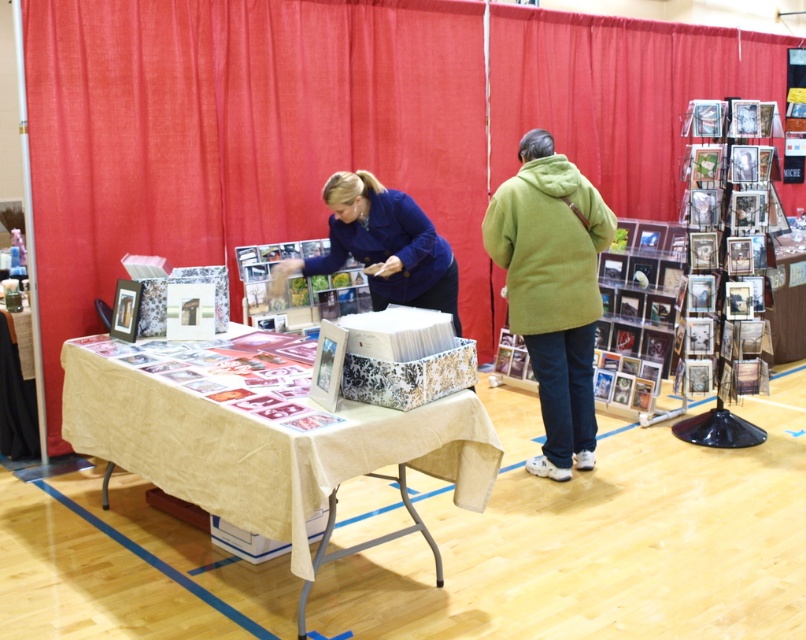
Which is above, green fuzzy jacket at center or blue fabric at center?

Positioned higher is blue fabric at center.

Who is positioned more to the right, green fuzzy jacket at center or blue fabric at center?

green fuzzy jacket at center

Who is more forward, [545,349] or [276,278]?

Point [545,349] is in front.

Locate an element on the screen. green fuzzy jacket at center is located at coordinates (551, 291).

Is beige fabric-covered table at center smaller than green fuzzy jacket at center?

Actually, beige fabric-covered table at center might be larger than green fuzzy jacket at center.

How far apart are beige fabric-covered table at center and green fuzzy jacket at center?

beige fabric-covered table at center and green fuzzy jacket at center are 1.42 meters apart.

At what (x,y) coordinates should I click in order to perform the action: click on beige fabric-covered table at center. Please return your answer as a coordinate pair (x, y). This screenshot has width=806, height=640. Looking at the image, I should click on (192, 448).

Is beige fabric-covered table at center to the right of blue fabric at center from the viewer's perspective?

Incorrect, beige fabric-covered table at center is not on the right side of blue fabric at center.

Can you confirm if beige fabric-covered table at center is bigger than blue fabric at center?

Yes.

Who is more forward, (73, 388) or (372, 224)?

Point (73, 388)

Identify the location of beige fabric-covered table at center. (192, 448).